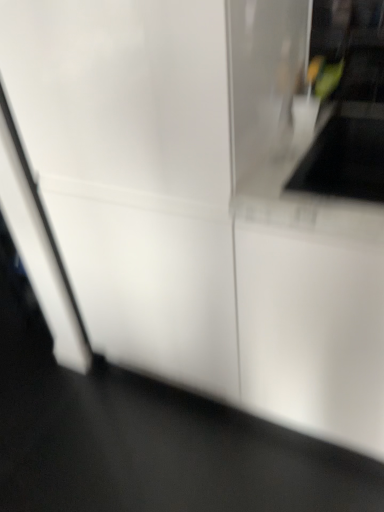
Describe the element at coordinates (156, 451) in the screenshot. I see `black matte floor at lower left` at that location.

Identify the location of black matte floor at lower left. (156, 451).

At what (x,y) coordinates should I click in order to perform the action: click on black matte floor at lower left. Please return your answer as a coordinate pair (x, y). Looking at the image, I should click on (156, 451).